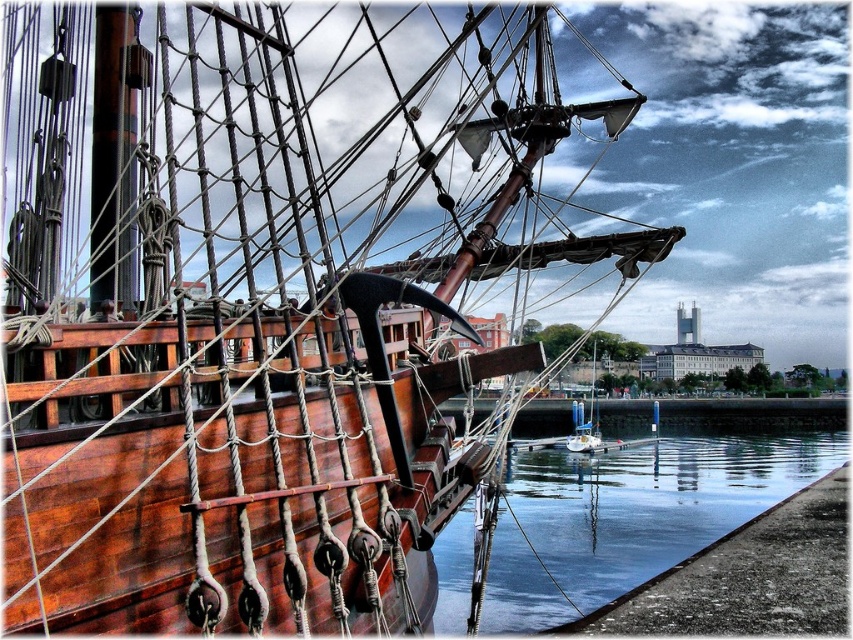
You are standing on the deck of the wooden ship and looking at two points marked on the rigging ropes. The points are labeled as point 1 at coordinate (x=511, y=499) and point 2 at (x=573, y=436). Which point is closer to your eyes?

Point 1 at coordinate (x=511, y=499) is closer to your eyes because it is closer to the camera than point 2 at (x=573, y=436).

You are standing on the dock and see the clear glass water at lower right and the wooden sailboat at center. Which object is located below the other?

The clear glass water at lower right is positioned under the wooden sailboat at center, meaning it is located below the wooden sailboat at center.